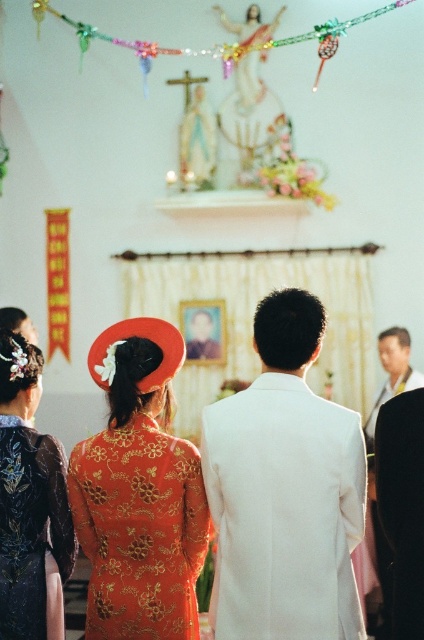
Question: Does white matte suit at center appear over shiny orange dress at center?

Choices:
 (A) yes
 (B) no

Answer: (A)

Question: Does matte gold dress at center appear on the right side of shiny orange dress at center?

Choices:
 (A) yes
 (B) no

Answer: (A)

Question: Which object is closer to the camera taking this photo?

Choices:
 (A) white matte suit at center
 (B) smooth black suit at right
 (C) shiny gold dress at center

Answer: (A)

Question: Estimate the real-world distances between objects in this image. Which object is closer to the matte gold dress at center?

Choices:
 (A) smooth black suit at right
 (B) shiny gold dress at center
 (C) shiny orange dress at center

Answer: (C)

Question: Can you confirm if shiny orange dress at center is bigger than smooth black suit at right?

Choices:
 (A) no
 (B) yes

Answer: (B)

Question: Which of the following is the closest to the observer?

Choices:
 (A) (385, 337)
 (B) (14, 589)

Answer: (B)